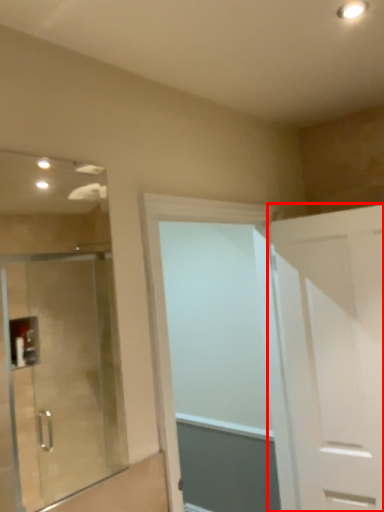
Question: From the image's perspective, where is door (annotated by the red box) located relative to door?

Choices:
 (A) above
 (B) below

Answer: (A)